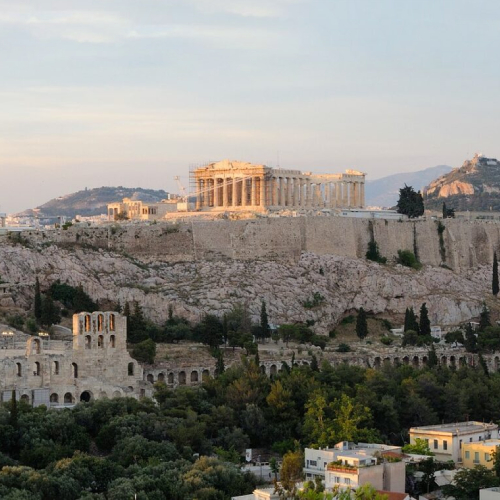
The image size is (500, 500). Identify the location of wall. (332, 232).